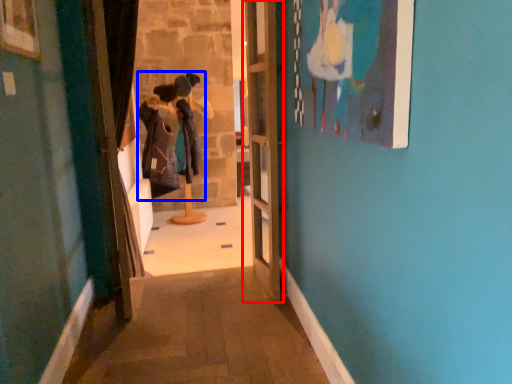
Question: Among these objects, which one is nearest to the camera, door (highlighted by a red box) or couple (highlighted by a blue box)?

Choices:
 (A) door
 (B) couple

Answer: (A)